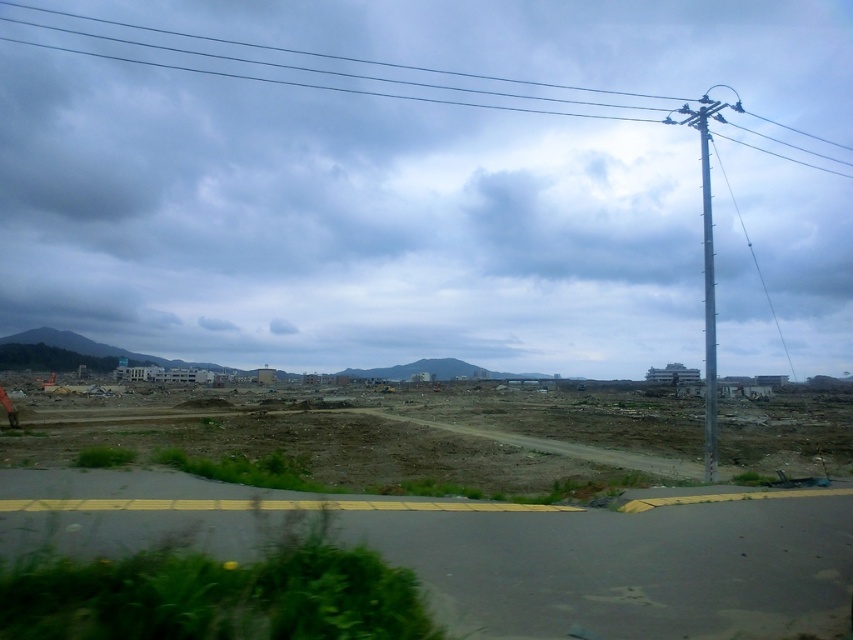
How much distance is there between metallic wire at upper center and silver metallic telegraph pole at right?

metallic wire at upper center is 63.91 meters from silver metallic telegraph pole at right.

Where is `metallic wire at upper center`? This screenshot has height=640, width=853. metallic wire at upper center is located at coordinates (335, 54).

This screenshot has height=640, width=853. Identify the location of metallic wire at upper center. (335, 54).

Between point (393, 336) and point (399, 97), which one is positioned behind?

The point (399, 97) is more distant.

Is cloudy sky at upper center closer to camera compared to metallic wire at upper center?

Yes, cloudy sky at upper center is closer to the viewer.

Measure the distance between cloudy sky at upper center and camera.

A distance of 14.21 meters exists between cloudy sky at upper center and camera.

You are a GUI agent. You are given a task and a screenshot of the screen. Output one action in this format:
    pyautogui.click(x=<x>, y=<y>)
    Task: Click on the cloudy sky at upper center
    
    Given the screenshot: What is the action you would take?
    point(384,173)

Which is above, cloudy sky at upper center or silver metallic telegraph pole at right?

Positioned higher is silver metallic telegraph pole at right.

Is cloudy sky at upper center bigger than silver metallic telegraph pole at right?

Yes, cloudy sky at upper center is bigger than silver metallic telegraph pole at right.

Is point (474, 260) more distant than point (693, 122)?

That is True.

Where is `cloudy sky at upper center`? cloudy sky at upper center is located at coordinates pyautogui.click(x=384, y=173).